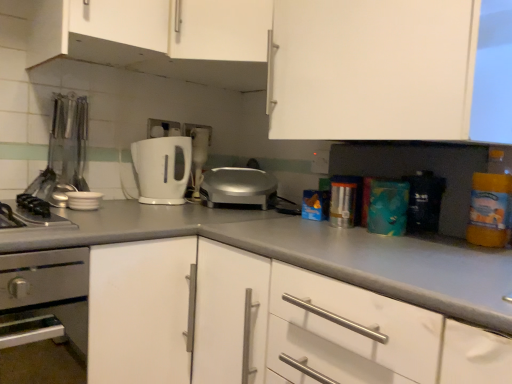
Question: From a real-world perspective, is translucent plastic bottle at right under silver metallic toaster at center, the 1th toaster viewed from the right?

Choices:
 (A) no
 (B) yes

Answer: (A)

Question: Can we say translucent plastic bottle at right lies outside silver metallic toaster at center, the 1th toaster viewed from the right?

Choices:
 (A) no
 (B) yes

Answer: (B)

Question: Is translucent plastic bottle at right bigger than silver metallic toaster at center, which is the second toaster from left to right?

Choices:
 (A) no
 (B) yes

Answer: (A)

Question: From the image's perspective, is translucent plastic bottle at right on top of silver metallic toaster at center, the 1th toaster viewed from the right?

Choices:
 (A) no
 (B) yes

Answer: (A)

Question: Is translucent plastic bottle at right positioned behind silver metallic toaster at center, which is the second toaster from left to right?

Choices:
 (A) yes
 (B) no

Answer: (B)

Question: Considering the positions of stainless steel oven at lower left and metallic silver utensils at left, arranged as the third appliance when viewed from the right, in the image, is stainless steel oven at lower left taller or shorter than metallic silver utensils at left, arranged as the third appliance when viewed from the right,?

Choices:
 (A) tall
 (B) short

Answer: (A)

Question: Looking at the image, does stainless steel oven at lower left seem bigger or smaller compared to metallic silver utensils at left, the 1th appliance positioned from the left?

Choices:
 (A) big
 (B) small

Answer: (A)

Question: Considering the positions of point coord(38,317) and point coord(70,117), is point coord(38,317) closer or farther from the camera than point coord(70,117)?

Choices:
 (A) closer
 (B) farther

Answer: (A)

Question: Relative to metallic silver utensils at left, the 1th appliance positioned from the left, is stainless steel oven at lower left in front or behind?

Choices:
 (A) front
 (B) behind

Answer: (A)

Question: From the image's perspective, is white matte countertop at center located above or below teal matte box at center, the 3th appliance when ordered from left to right?

Choices:
 (A) below
 (B) above

Answer: (A)

Question: Based on their sizes in the image, would you say white matte countertop at center is bigger or smaller than teal matte box at center, the 3th appliance when ordered from left to right?

Choices:
 (A) small
 (B) big

Answer: (B)

Question: Is white matte countertop at center taller or shorter than teal matte box at center, the 3th appliance when ordered from left to right?

Choices:
 (A) tall
 (B) short

Answer: (A)

Question: Considering the relative positions of white matte countertop at center and teal matte box at center, the 3th appliance when ordered from left to right, in the image provided, is white matte countertop at center to the left or to the right of teal matte box at center, the 3th appliance when ordered from left to right,?

Choices:
 (A) left
 (B) right

Answer: (A)

Question: Is point (307, 231) closer or farther from the camera than point (193, 46)?

Choices:
 (A) farther
 (B) closer

Answer: (B)

Question: Is white matte cabinet at center, acting as the 4th cabinetry starting from the top, inside the boundaries of white matte cabinet at upper center, arranged as the fourth cabinetry when ordered from the bottom, or outside?

Choices:
 (A) inside
 (B) outside

Answer: (B)